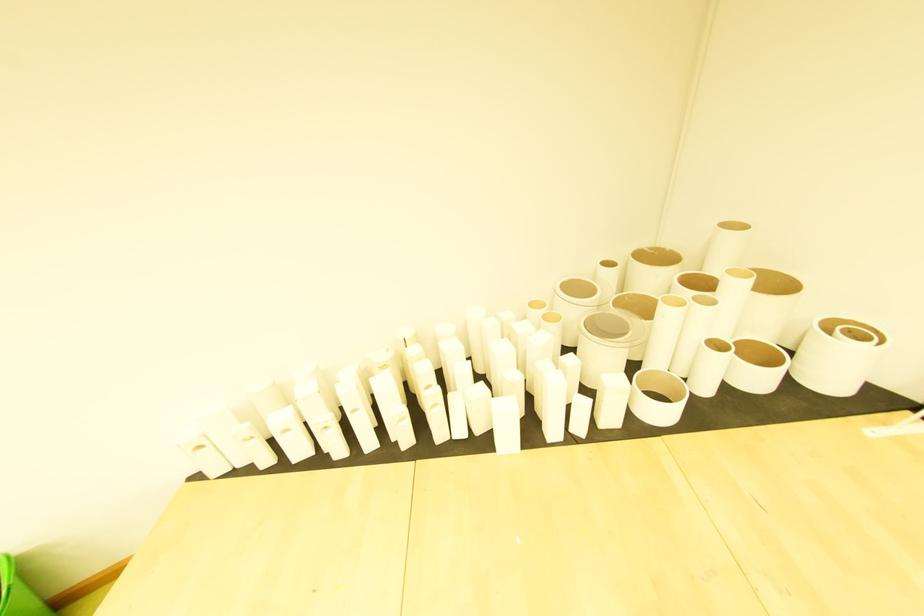
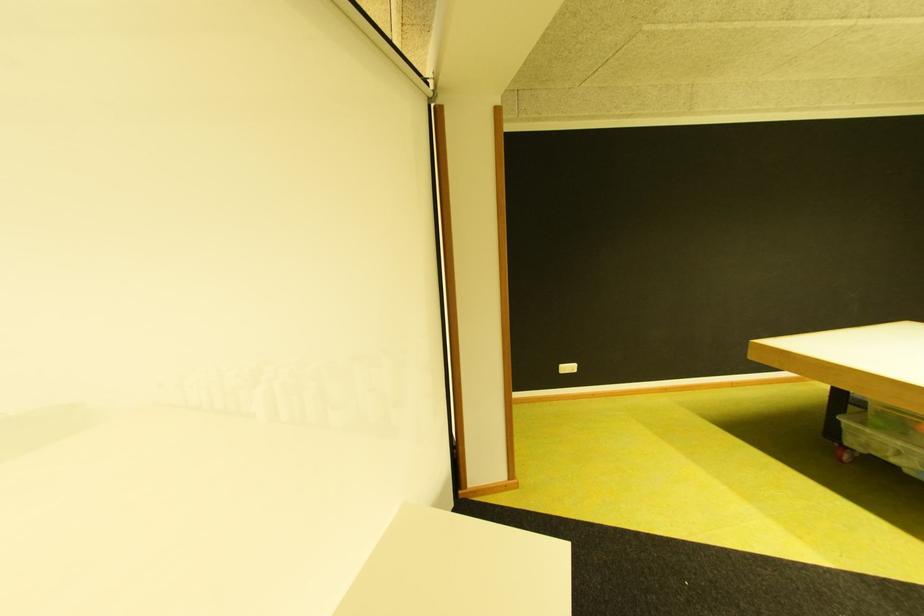
In a continuous first-person perspective shot, in which direction is the camera moving?

The movement direction of the cameraman is right, backward.